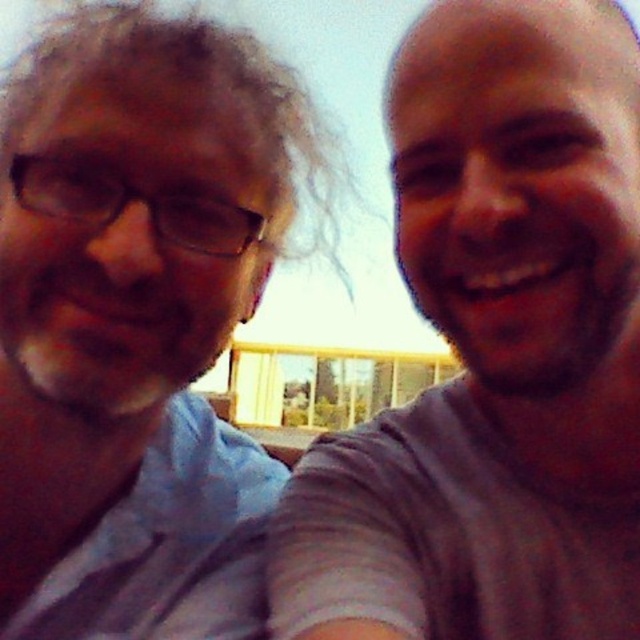
Does gray cotton shirt at upper right have a larger size compared to matte blue shirt at left?

No, gray cotton shirt at upper right is not bigger than matte blue shirt at left.

Can you confirm if gray cotton shirt at upper right is positioned to the right of matte blue shirt at left?

Yes, gray cotton shirt at upper right is to the right of matte blue shirt at left.

Which is behind, point (404, 172) or point (54, 538)?

The point (54, 538) is behind.

Locate an element on the screen. gray cotton shirt at upper right is located at coordinates (493, 349).